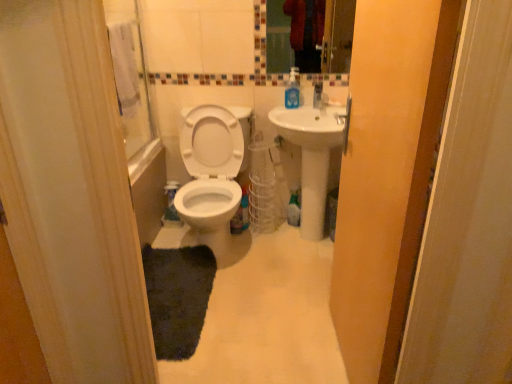
What do you see at coordinates (211, 174) in the screenshot? I see `white glossy toilet at center` at bounding box center [211, 174].

The height and width of the screenshot is (384, 512). What do you see at coordinates (378, 171) in the screenshot? I see `transparent plastic screen door at upper center` at bounding box center [378, 171].

This screenshot has width=512, height=384. What do you see at coordinates (282, 35) in the screenshot?
I see `matte glass mirror at upper center` at bounding box center [282, 35].

Find the location of a particular element. dark gray plush rug at center is located at coordinates (178, 297).

From their relative heights in the image, would you say white glossy toilet at center is taller or shorter than matte glass mirror at upper center?

Considering their sizes, white glossy toilet at center has more height than matte glass mirror at upper center.

Looking at their sizes, would you say white glossy toilet at center is wider or thinner than matte glass mirror at upper center?

Considering their sizes, white glossy toilet at center looks broader than matte glass mirror at upper center.

Is there a large distance between white glossy toilet at center and matte glass mirror at upper center?

Indeed, white glossy toilet at center is not near matte glass mirror at upper center.

Does matte glass mirror at upper center turn towards white ceramic sink at center?

No, matte glass mirror at upper center is not oriented towards white ceramic sink at center.

Does matte glass mirror at upper center come behind white ceramic sink at center?

That is True.

Is white ceramic sink at center a part of matte glass mirror at upper center?

No, white ceramic sink at center is not a part of matte glass mirror at upper center.

Is matte glass mirror at upper center bigger than white matte toilet at center?

No, matte glass mirror at upper center is not bigger than white matte toilet at center.

Is the position of matte glass mirror at upper center more distant than that of white matte toilet at center?

Yes, the depth of matte glass mirror at upper center is greater than that of white matte toilet at center.

Is matte glass mirror at upper center situated inside white matte toilet at center or outside?

matte glass mirror at upper center is located beyond the bounds of white matte toilet at center.

How different are the orientations of matte glass mirror at upper center and white matte toilet at center in degrees?

There is a 0.165-degree angle between the facing directions of matte glass mirror at upper center and white matte toilet at center.

Considering the relative sizes of white ceramic sink at center and blue translucent soap dispenser at upper right in the image provided, is white ceramic sink at center bigger than blue translucent soap dispenser at upper right?

Correct, white ceramic sink at center is larger in size than blue translucent soap dispenser at upper right.

Does point (305, 108) appear closer or farther from the camera than point (292, 91)?

Point (305, 108) is positioned farther from the camera compared to point (292, 91).

Is white ceramic sink at center beside blue translucent soap dispenser at upper right?

No, white ceramic sink at center is not beside blue translucent soap dispenser at upper right.

How different are the orientations of white ceramic sink at center and blue translucent soap dispenser at upper right in degrees?

There is a 4.24-degree angle between the facing directions of white ceramic sink at center and blue translucent soap dispenser at upper right.

From the image's perspective, is dark gray plush rug at center under white ceramic sink at center?

Yes, from the image's perspective, dark gray plush rug at center is below white ceramic sink at center.

Can you confirm if dark gray plush rug at center is thinner than white ceramic sink at center?

Correct, the width of dark gray plush rug at center is less than that of white ceramic sink at center.

Does dark gray plush rug at center turn towards white ceramic sink at center?

No.

Are dark gray plush rug at center and white ceramic sink at center making contact?

No, dark gray plush rug at center is not beside white ceramic sink at center.

From the picture: Is the position of blue translucent soap dispenser at upper right less distant than that of transparent plastic screen door at upper center?

No, the depth of blue translucent soap dispenser at upper right is greater than that of transparent plastic screen door at upper center.

From a real-world perspective, is blue translucent soap dispenser at upper right located higher than transparent plastic screen door at upper center?

Yes, from a real-world perspective, blue translucent soap dispenser at upper right is above transparent plastic screen door at upper center.

How much distance is there between blue translucent soap dispenser at upper right and transparent plastic screen door at upper center?

blue translucent soap dispenser at upper right and transparent plastic screen door at upper center are 4.09 feet apart.

Would you say blue translucent soap dispenser at upper right is outside transparent plastic screen door at upper center?

Indeed, blue translucent soap dispenser at upper right is completely outside transparent plastic screen door at upper center.

From the image's perspective, between dark gray plush rug at center and transparent plastic screen door at upper center, who is located below?

dark gray plush rug at center.

Does dark gray plush rug at center have a larger size compared to transparent plastic screen door at upper center?

No.

Is dark gray plush rug at center wider or thinner than transparent plastic screen door at upper center?

In the image, dark gray plush rug at center appears to be wider than transparent plastic screen door at upper center.

Between dark gray plush rug at center and transparent plastic screen door at upper center, which one appears on the right side from the viewer's perspective?

From the viewer's perspective, transparent plastic screen door at upper center appears more on the right side.

Image resolution: width=512 pixels, height=384 pixels. In the image, there is a matte glass mirror at upper center. Identify the location of toilet below it (from a real-world perspective). (211, 174).

Where is `sink in front of the matte glass mirror at upper center`? The image size is (512, 384). sink in front of the matte glass mirror at upper center is located at coordinates (313, 155).

Based on their spatial positions, is matte glass mirror at upper center or blue translucent soap dispenser at upper right further from white ceramic sink at center?

matte glass mirror at upper center is further to white ceramic sink at center.

Looking at the image, which one is located further to blue translucent soap dispenser at upper right, dark gray plush rug at center or white glossy toilet at center?

dark gray plush rug at center lies further to blue translucent soap dispenser at upper right than the other object.

Looking at the image, which one is located further to white glossy toilet at center, white matte toilet at center or matte glass mirror at upper center?

matte glass mirror at upper center.

Estimate the real-world distances between objects in this image. Which object is further from blue translucent soap dispenser at upper right, white matte toilet at center or transparent plastic screen door at upper center?

The object further to blue translucent soap dispenser at upper right is transparent plastic screen door at upper center.

Which object lies nearer to the anchor point dark gray plush rug at center, white glossy toilet at center or matte glass mirror at upper center?

Among the two, white glossy toilet at center is located nearer to dark gray plush rug at center.

From the image, which object appears to be nearer to transparent plastic screen door at upper center, white glossy toilet at center or dark gray plush rug at center?

dark gray plush rug at center is positioned closer to the anchor transparent plastic screen door at upper center.

Looking at the image, which one is located further to matte glass mirror at upper center, transparent plastic screen door at upper center or white ceramic sink at center?

transparent plastic screen door at upper center is further to matte glass mirror at upper center.

Based on their spatial positions, is blue translucent soap dispenser at upper right or matte glass mirror at upper center closer to white matte toilet at center?

blue translucent soap dispenser at upper right is positioned closer to the anchor white matte toilet at center.

The width and height of the screenshot is (512, 384). I want to click on soap dispenser that lies between matte glass mirror at upper center and white glossy toilet at center from top to bottom, so click(x=293, y=90).

Locate an element on the screen. The height and width of the screenshot is (384, 512). mat positioned between transparent plastic screen door at upper center and matte glass mirror at upper center from near to far is located at coordinates (178, 297).

This screenshot has height=384, width=512. I want to click on plain located between transparent plastic screen door at upper center and matte glass mirror at upper center in the depth direction, so click(267, 317).

Where is `soap dispenser between matte glass mirror at upper center and dark gray plush rug at center in the vertical direction`? The height and width of the screenshot is (384, 512). soap dispenser between matte glass mirror at upper center and dark gray plush rug at center in the vertical direction is located at coordinates (293, 90).